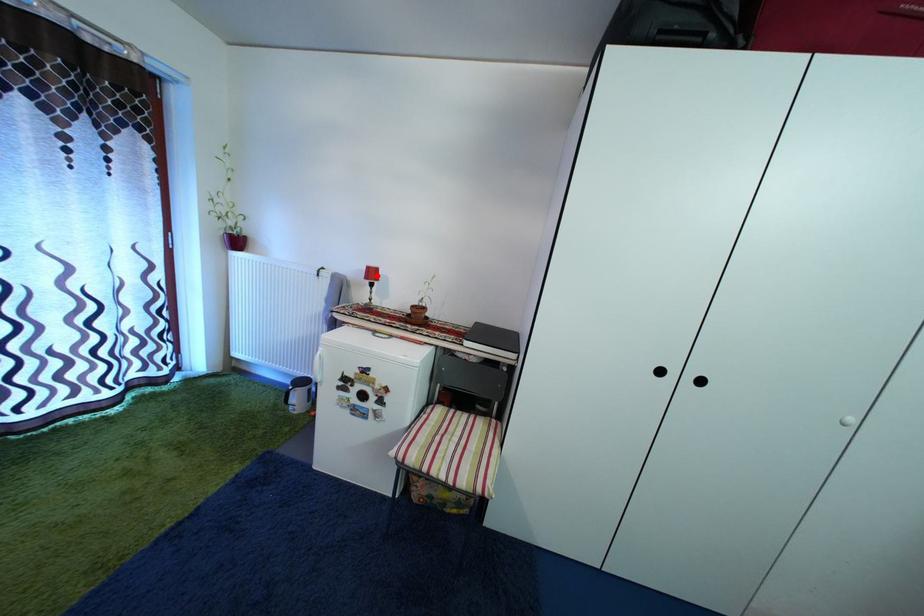
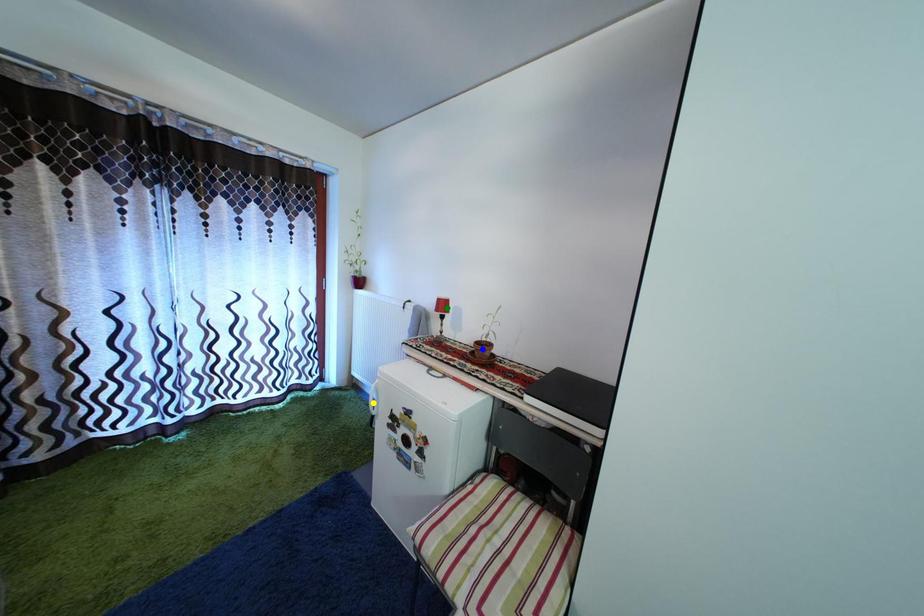
Question: I am providing you with two images of the same scene from different viewpoints. A red point is marked on the first image. You are given multiple points on the second image. Which spot in image 2 lines up with the point in image 1?

Choices:
 (A) yellow point
 (B) blue point
 (C) green point

Answer: (C)